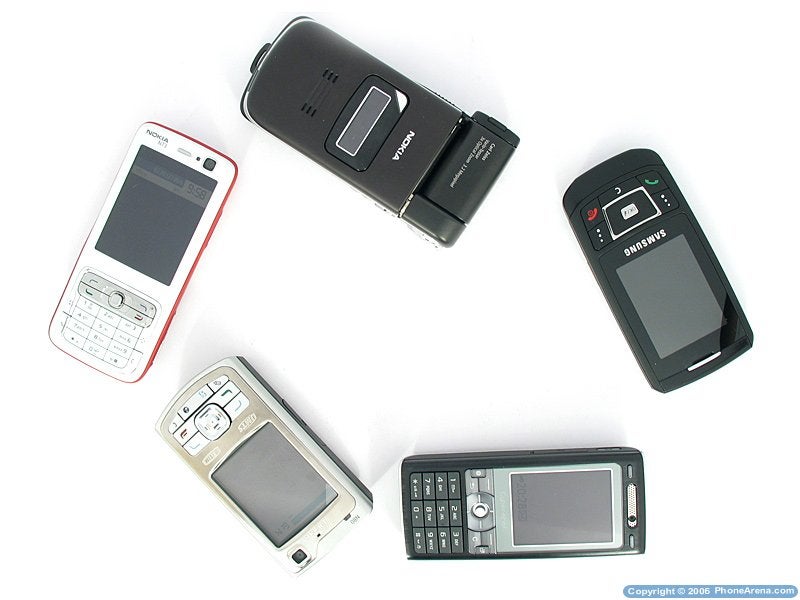
The width and height of the screenshot is (800, 600). I want to click on phone display screen, so click(x=152, y=232), click(x=352, y=121), click(x=288, y=478), click(x=586, y=499), click(x=668, y=298).